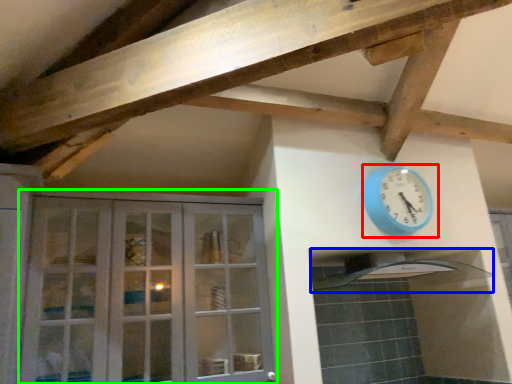
Question: Based on their relative distances, which object is farther from wall clock (highlighted by a red box)? Choose from exhaust hood (highlighted by a blue box) and cabinetry (highlighted by a green box).

Choices:
 (A) exhaust hood
 (B) cabinetry

Answer: (B)